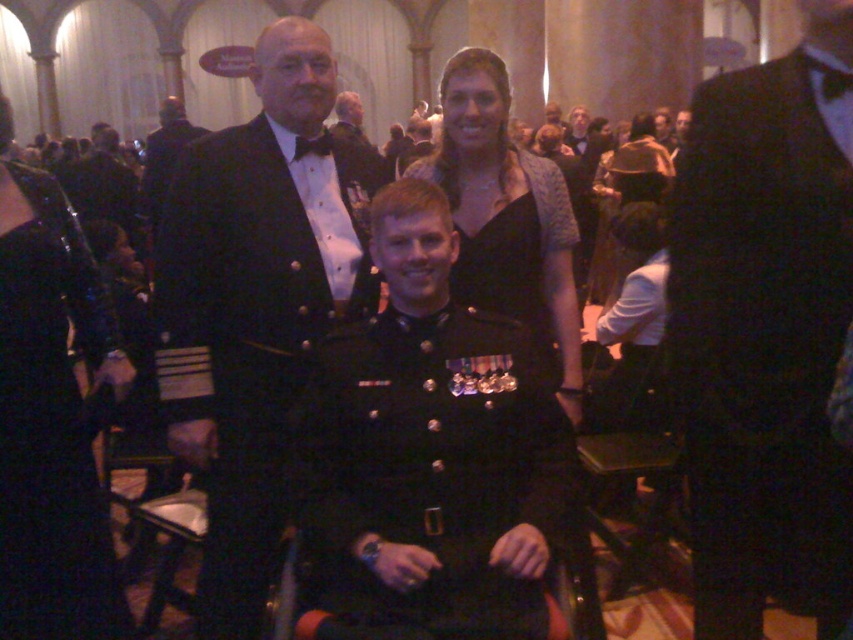
Question: Is black satin suit at center thinner than shiny black uniform at center?

Choices:
 (A) no
 (B) yes

Answer: (B)

Question: Which point appears closest to the camera in this image?

Choices:
 (A) (850, 497)
 (B) (48, 282)
 (C) (202, 168)

Answer: (A)

Question: Which point is farther to the camera?

Choices:
 (A) shiny black dress at upper center
 (B) shiny black suit at center
 (C) black satin suit at center
 (D) shiny black uniform at center

Answer: (A)

Question: Estimate the real-world distances between objects in this image. Which object is closer to the black satin suit at center?

Choices:
 (A) shiny black dress at upper center
 (B) shiny black uniform at center

Answer: (A)

Question: Can you confirm if black satin suit at center is positioned below shiny black dress at upper center?

Choices:
 (A) yes
 (B) no

Answer: (A)

Question: Is shiny black uniform at center above black satin bow tie at upper center?

Choices:
 (A) yes
 (B) no

Answer: (B)